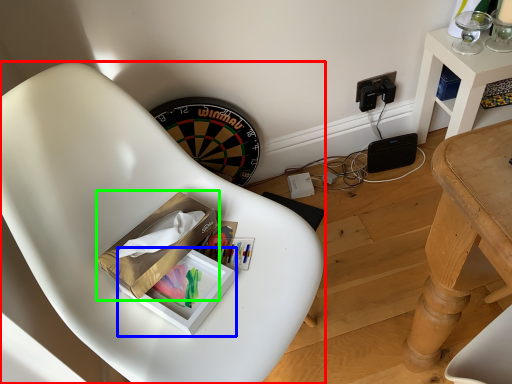
Question: Which is nearer to the chair (highlighted by a red box)? box (highlighted by a blue box) or cardboard box (highlighted by a green box).

Choices:
 (A) box
 (B) cardboard box

Answer: (B)